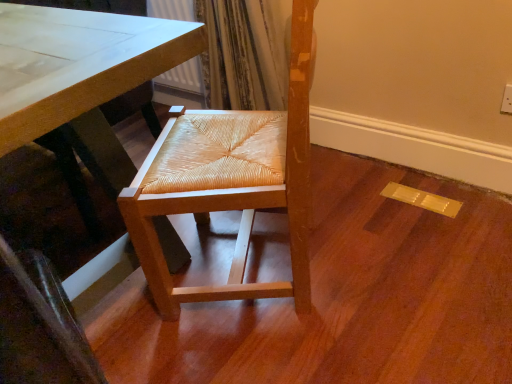
Find the location of a particular element. natural wood chair at center is located at coordinates (343, 297).

Considering the sizes of natural wood chair at center and natural wood woven seat at center in the image, is natural wood chair at center taller or shorter than natural wood woven seat at center?

In the image, natural wood chair at center appears to be shorter than natural wood woven seat at center.

In terms of size, does natural wood chair at center appear bigger or smaller than natural wood woven seat at center?

In the image, natural wood chair at center appears to be smaller than natural wood woven seat at center.

Considering the positions of points (223, 214) and (204, 199), is point (223, 214) farther from camera compared to point (204, 199)?

Yes, point (223, 214) is farther from viewer.

Does matte white table at center have a smaller size compared to natural wood chair at center?

No, matte white table at center is not smaller than natural wood chair at center.

Is natural wood chair at center a part of matte white table at center?

No, natural wood chair at center is not inside matte white table at center.

Are matte white table at center and natural wood chair at center making contact?

matte white table at center is not next to natural wood chair at center, and they're not touching.

Is natural wood chair at center at the back of matte white table at center?

No, matte white table at center's orientation is not away from natural wood chair at center.

Is matte white table at center taller or shorter than natural wood woven seat at center?

Considering their sizes, matte white table at center has less height than natural wood woven seat at center.

Is matte white table at center directly adjacent to natural wood woven seat at center?

They are not placed beside each other.

Consider the image. Is matte white table at center further to the viewer compared to natural wood woven seat at center?

No, the depth of matte white table at center is less than that of natural wood woven seat at center.

Is natural wood chair at center aimed at matte white table at center?

No, natural wood chair at center does not turn towards matte white table at center.

From a real-world perspective, is natural wood chair at center below matte white table at center?

Yes, from a real-world perspective, natural wood chair at center is under matte white table at center.

Does natural wood chair at center have a greater width compared to matte white table at center?

Indeed, natural wood chair at center has a greater width compared to matte white table at center.

Which of these two, natural wood chair at center or matte white table at center, stands taller?

With more height is matte white table at center.

From the image's perspective, is natural wood woven seat at center located beneath natural wood chair at center?

Actually, natural wood woven seat at center appears above natural wood chair at center in the image.

Where is `chair in front of the natural wood chair at center`? chair in front of the natural wood chair at center is located at coordinates (230, 183).

From a real-world perspective, between natural wood woven seat at center and natural wood chair at center, who is vertically higher?

In real-world perspective, natural wood woven seat at center is above.

What's the angular difference between natural wood woven seat at center and natural wood chair at center's facing directions?

The angle between the facing direction of natural wood woven seat at center and the facing direction of natural wood chair at center is 147 degrees.

Which is more to the right, natural wood woven seat at center or matte white table at center?

From the viewer's perspective, natural wood woven seat at center appears more on the right side.

What are the coordinates of `table below the natural wood woven seat at center (from a real-world perspective)` in the screenshot? It's located at [81, 83].

Looking at this image, considering the relative sizes of natural wood woven seat at center and matte white table at center in the image provided, is natural wood woven seat at center taller than matte white table at center?

Yes, natural wood woven seat at center is taller than matte white table at center.

Is natural wood woven seat at center further to camera compared to matte white table at center?

Yes.

You are a GUI agent. You are given a task and a screenshot of the screen. Output one action in this format:
    pyautogui.click(x=<x>, y=<y>)
    Task: Click on the plywood on the right of natural wood woven seat at center
    This screenshot has width=512, height=384.
    Given the screenshot: What is the action you would take?
    pyautogui.click(x=343, y=297)

Find the location of `table on the left of natural wood chair at center`. table on the left of natural wood chair at center is located at coordinates (81, 83).

Estimate the real-world distances between objects in this image. Which object is closer to natural wood chair at center, natural wood woven seat at center or matte white table at center?

Based on the image, natural wood woven seat at center appears to be nearer to natural wood chair at center.

From the image, which object appears to be farther from natural wood woven seat at center, natural wood chair at center or matte white table at center?

natural wood chair at center is positioned further to the anchor natural wood woven seat at center.

Based on their spatial positions, is matte white table at center or natural wood chair at center further from natural wood woven seat at center?

natural wood chair at center is further to natural wood woven seat at center.

When comparing their distances from natural wood chair at center, does matte white table at center or natural wood woven seat at center seem further?

matte white table at center lies further to natural wood chair at center than the other object.

Estimate the real-world distances between objects in this image. Which object is closer to matte white table at center, natural wood woven seat at center or natural wood chair at center?

natural wood woven seat at center lies closer to matte white table at center than the other object.

From the image, which object appears to be nearer to matte white table at center, natural wood chair at center or natural wood woven seat at center?

Among the two, natural wood woven seat at center is located nearer to matte white table at center.

Find the location of a particular element. The image size is (512, 384). chair between matte white table at center and natural wood chair at center is located at coordinates (230, 183).